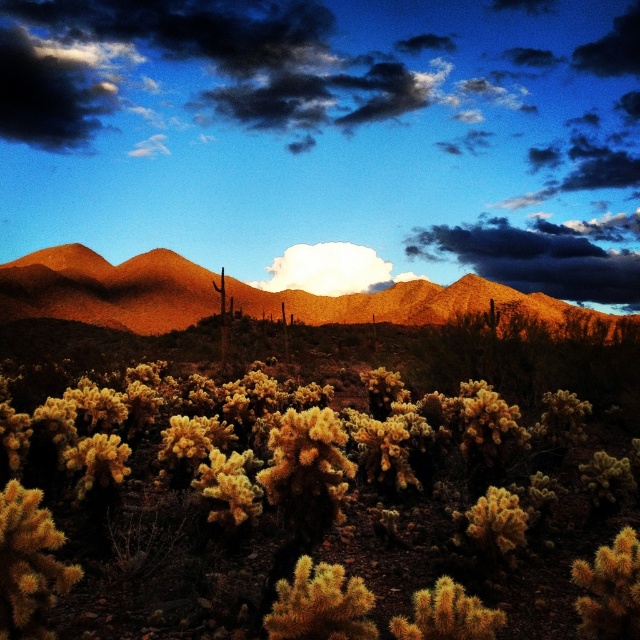
Question: Does rustic brown mountains at upper center appear on the left side of dark gray cloud at upper center?

Choices:
 (A) no
 (B) yes

Answer: (B)

Question: Is rustic brown mountains at upper center positioned in front of dark gray cloud at upper center?

Choices:
 (A) yes
 (B) no

Answer: (A)

Question: Which of the following is the closest to the observer?

Choices:
 (A) (182, 289)
 (B) (413, 244)

Answer: (A)

Question: Observing the image, what is the correct spatial positioning of rustic brown mountains at upper center in reference to dark gray cloud at upper center?

Choices:
 (A) left
 (B) right

Answer: (A)

Question: Which point is closer to the camera taking this photo?

Choices:
 (A) (593, 236)
 (B) (145, 308)

Answer: (B)

Question: Which of the following is the closest to the observer?

Choices:
 (A) (19, 273)
 (B) (406, 256)

Answer: (A)